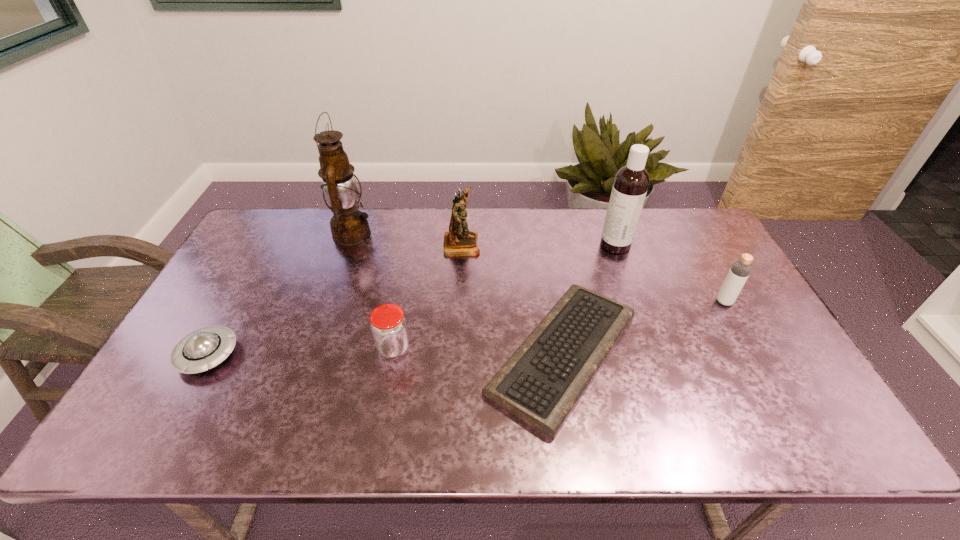
I want to click on blank space located on the left of the computer keyboard, so click(338, 354).

This screenshot has height=540, width=960. Find the location of `oil lamp present at the far edge`. oil lamp present at the far edge is located at coordinates (349, 226).

Image resolution: width=960 pixels, height=540 pixels. Find the location of `dishwasher detergent at the far edge`. dishwasher detergent at the far edge is located at coordinates (631, 182).

You are a GUI agent. You are given a task and a screenshot of the screen. Output one action in this format:
    pyautogui.click(x=<x>, y=<y>)
    Task: Click on the figurine that is positioned at the far edge
    
    Given the screenshot: What is the action you would take?
    [x=458, y=241]

Where is `object that is at the near edge`? The height and width of the screenshot is (540, 960). object that is at the near edge is located at coordinates (541, 383).

The height and width of the screenshot is (540, 960). In order to click on object situated at the left edge in this screenshot , I will do `click(204, 348)`.

Image resolution: width=960 pixels, height=540 pixels. In order to click on object present at the right edge in this screenshot , I will do `click(740, 270)`.

The width and height of the screenshot is (960, 540). In the image, there is a desktop. Find the location of `vacant space at the far edge`. vacant space at the far edge is located at coordinates (440, 251).

Locate an element on the screen. Image resolution: width=960 pixels, height=540 pixels. free point at the near edge is located at coordinates (x=683, y=444).

Locate an element on the screen. This screenshot has height=540, width=960. blank space at the left edge of the desktop is located at coordinates (272, 259).